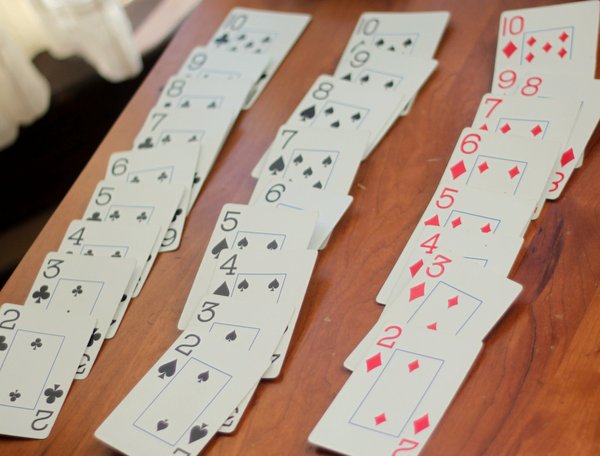
At what (x,y) coordinates should I click in order to perform the action: click on table. Please return your answer as a coordinate pair (x, y). The width and height of the screenshot is (600, 456). Looking at the image, I should click on (350, 289).